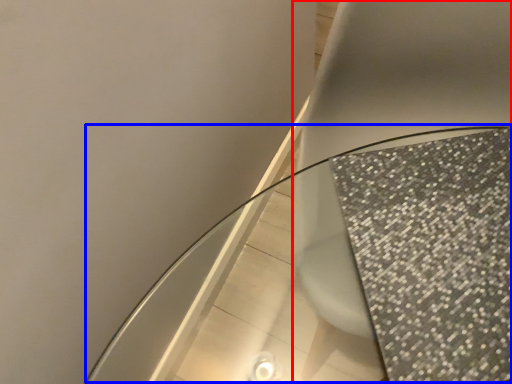
Question: Which point is closer to the camera, toilet (highlighted by a red box) or round table (highlighted by a blue box)?

Choices:
 (A) toilet
 (B) round table

Answer: (B)